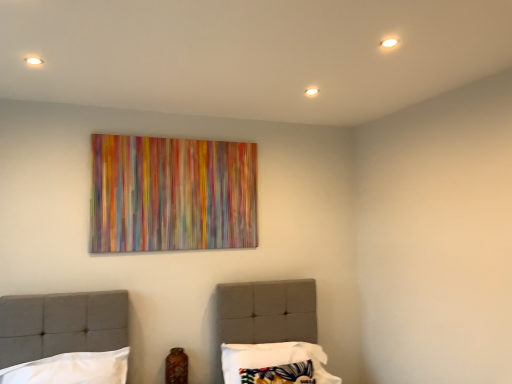
This screenshot has width=512, height=384. What do you see at coordinates (273, 359) in the screenshot?
I see `patterned fabric pillow at center, the 1th pillow when ordered from right to left` at bounding box center [273, 359].

At what (x,y) coordinates should I click in order to perform the action: click on patterned fabric pillow at center, the second pillow when ordered from left to right. Please return your answer as a coordinate pair (x, y). This screenshot has width=512, height=384. Looking at the image, I should click on (273, 359).

Where is `white fabric pillow at lower left, which ranks as the 1th pillow in left-to-right order`? white fabric pillow at lower left, which ranks as the 1th pillow in left-to-right order is located at coordinates (71, 369).

This screenshot has height=384, width=512. Describe the element at coordinates (71, 369) in the screenshot. I see `white fabric pillow at lower left, which ranks as the 1th pillow in left-to-right order` at that location.

At what (x,y) coordinates should I click in order to perform the action: click on patterned fabric pillow at center, the second pillow when ordered from left to right. Please return your answer as a coordinate pair (x, y). The width and height of the screenshot is (512, 384). Looking at the image, I should click on (273, 359).

Is white fabric pillow at lower left, which ranks as the 1th pillow in left-to-right order, to the right of patterned fabric pillow at center, the 1th pillow when ordered from right to left, from the viewer's perspective?

In fact, white fabric pillow at lower left, which ranks as the 1th pillow in left-to-right order, is to the left of patterned fabric pillow at center, the 1th pillow when ordered from right to left.

Is the depth of white fabric pillow at lower left, which is the 2th pillow from right to left, greater than that of patterned fabric pillow at center, the 1th pillow when ordered from right to left?

No.

Which is in front, point (119, 354) or point (270, 346)?

Positioned in front is point (119, 354).

From the image's perspective, does white fabric pillow at lower left, which ranks as the 1th pillow in left-to-right order, appear lower than patterned fabric pillow at center, the 1th pillow when ordered from right to left?

→ Actually, white fabric pillow at lower left, which ranks as the 1th pillow in left-to-right order, appears above patterned fabric pillow at center, the 1th pillow when ordered from right to left, in the image.

From a real-world perspective, which object stands above the other?

In real-world perspective, white fabric pillow at lower left, which is the 2th pillow from right to left, is above.

Considering the sizes of objects white fabric pillow at lower left, which is the 2th pillow from right to left, and patterned fabric pillow at center, the second pillow when ordered from left to right, in the image provided, who is thinner, white fabric pillow at lower left, which is the 2th pillow from right to left, or patterned fabric pillow at center, the second pillow when ordered from left to right,?

white fabric pillow at lower left, which is the 2th pillow from right to left.

Considering the sizes of white fabric pillow at lower left, which ranks as the 1th pillow in left-to-right order, and patterned fabric pillow at center, the 1th pillow when ordered from right to left, in the image, is white fabric pillow at lower left, which ranks as the 1th pillow in left-to-right order, taller or shorter than patterned fabric pillow at center, the 1th pillow when ordered from right to left,?

Considering their sizes, white fabric pillow at lower left, which ranks as the 1th pillow in left-to-right order, has less height than patterned fabric pillow at center, the 1th pillow when ordered from right to left.

Which of these two, white fabric pillow at lower left, which ranks as the 1th pillow in left-to-right order, or patterned fabric pillow at center, the 1th pillow when ordered from right to left, is smaller?

Smaller between the two is white fabric pillow at lower left, which ranks as the 1th pillow in left-to-right order.

Can we say white fabric pillow at lower left, which ranks as the 1th pillow in left-to-right order, lies outside patterned fabric pillow at center, the 1th pillow when ordered from right to left?

Yes, white fabric pillow at lower left, which ranks as the 1th pillow in left-to-right order, is not within patterned fabric pillow at center, the 1th pillow when ordered from right to left.

Is white fabric pillow at lower left, which ranks as the 1th pillow in left-to-right order, not close to patterned fabric pillow at center, the 1th pillow when ordered from right to left?

Actually, white fabric pillow at lower left, which ranks as the 1th pillow in left-to-right order, and patterned fabric pillow at center, the 1th pillow when ordered from right to left, are a little close together.

Is white fabric pillow at lower left, which ranks as the 1th pillow in left-to-right order, aimed at patterned fabric pillow at center, the 1th pillow when ordered from right to left?

No, white fabric pillow at lower left, which ranks as the 1th pillow in left-to-right order, is not oriented towards patterned fabric pillow at center, the 1th pillow when ordered from right to left.

Image resolution: width=512 pixels, height=384 pixels. I want to click on pillow on the right of white fabric pillow at lower left, which ranks as the 1th pillow in left-to-right order, so click(273, 359).

Which is more to the right, patterned fabric pillow at center, the second pillow when ordered from left to right, or white fabric pillow at lower left, which ranks as the 1th pillow in left-to-right order?

Positioned to the right is patterned fabric pillow at center, the second pillow when ordered from left to right.

Which object is closer to the camera taking this photo, patterned fabric pillow at center, the second pillow when ordered from left to right, or white fabric pillow at lower left, which ranks as the 1th pillow in left-to-right order?

Positioned in front is white fabric pillow at lower left, which ranks as the 1th pillow in left-to-right order.

Which is in front, point (224, 377) or point (99, 355)?

The point (99, 355) is closer.

From the image's perspective, is patterned fabric pillow at center, the second pillow when ordered from left to right, located above white fabric pillow at lower left, which ranks as the 1th pillow in left-to-right order?

No.

From a real-world perspective, is patterned fabric pillow at center, the second pillow when ordered from left to right, on top of white fabric pillow at lower left, which is the 2th pillow from right to left?

Incorrect, from a real-world perspective, patterned fabric pillow at center, the second pillow when ordered from left to right, is lower than white fabric pillow at lower left, which is the 2th pillow from right to left.

In terms of width, does patterned fabric pillow at center, the 1th pillow when ordered from right to left, look wider or thinner when compared to white fabric pillow at lower left, which is the 2th pillow from right to left?

patterned fabric pillow at center, the 1th pillow when ordered from right to left, is wider than white fabric pillow at lower left, which is the 2th pillow from right to left.

Considering the relative sizes of patterned fabric pillow at center, the second pillow when ordered from left to right, and white fabric pillow at lower left, which is the 2th pillow from right to left, in the image provided, is patterned fabric pillow at center, the second pillow when ordered from left to right, shorter than white fabric pillow at lower left, which is the 2th pillow from right to left,?

No.

In terms of size, does patterned fabric pillow at center, the 1th pillow when ordered from right to left, appear bigger or smaller than white fabric pillow at lower left, which is the 2th pillow from right to left?

Clearly, patterned fabric pillow at center, the 1th pillow when ordered from right to left, is larger in size than white fabric pillow at lower left, which is the 2th pillow from right to left.

Is patterned fabric pillow at center, the second pillow when ordered from left to right, situated inside white fabric pillow at lower left, which is the 2th pillow from right to left, or outside?

patterned fabric pillow at center, the second pillow when ordered from left to right, is not inside white fabric pillow at lower left, which is the 2th pillow from right to left, it's outside.

Would you consider patterned fabric pillow at center, the 1th pillow when ordered from right to left, to be distant from white fabric pillow at lower left, which ranks as the 1th pillow in left-to-right order?

No, patterned fabric pillow at center, the 1th pillow when ordered from right to left, is in close proximity to white fabric pillow at lower left, which ranks as the 1th pillow in left-to-right order.

Is patterned fabric pillow at center, the second pillow when ordered from left to right, facing towards white fabric pillow at lower left, which ranks as the 1th pillow in left-to-right order?

No, patterned fabric pillow at center, the second pillow when ordered from left to right, is not turned towards white fabric pillow at lower left, which ranks as the 1th pillow in left-to-right order.

Measure the distance from patterned fabric pillow at center, the 1th pillow when ordered from right to left, to white fabric pillow at lower left, which ranks as the 1th pillow in left-to-right order.

patterned fabric pillow at center, the 1th pillow when ordered from right to left, and white fabric pillow at lower left, which ranks as the 1th pillow in left-to-right order, are 38.79 inches apart from each other.

The height and width of the screenshot is (384, 512). Find the location of `pillow below the white fabric pillow at lower left, which is the 2th pillow from right to left (from the image's perspective)`. pillow below the white fabric pillow at lower left, which is the 2th pillow from right to left (from the image's perspective) is located at coordinates click(x=273, y=359).

At what (x,y) coordinates should I click in order to perform the action: click on pillow above the patterned fabric pillow at center, the 1th pillow when ordered from right to left (from the image's perspective). Please return your answer as a coordinate pair (x, y). Image resolution: width=512 pixels, height=384 pixels. Looking at the image, I should click on (71, 369).

Identify the location of pillow that appears in front of the patterned fabric pillow at center, the 1th pillow when ordered from right to left. (71, 369).